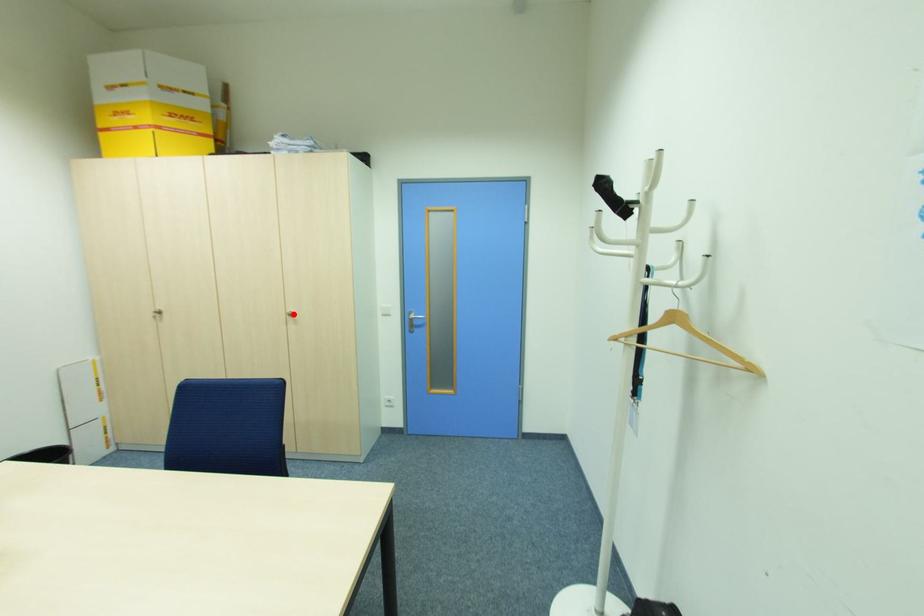
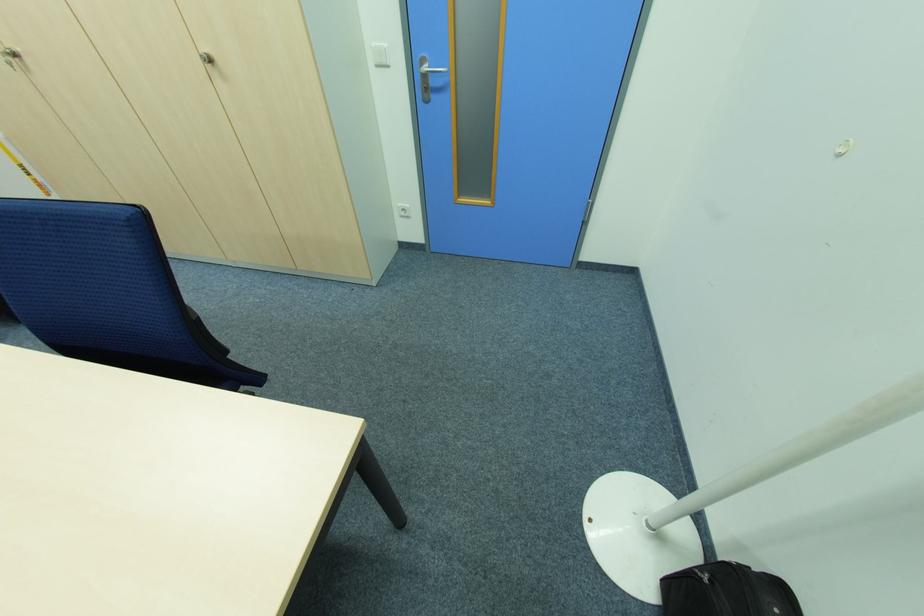
Find the pixel in the second image that matches the highlighted location in the first image.

(213, 62)